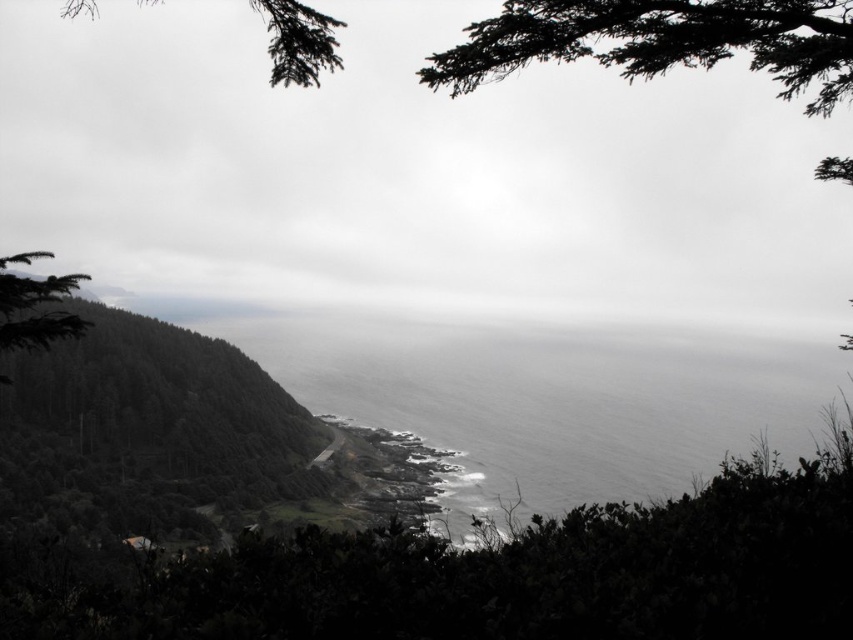
You are a photographer positioned at the center of the scene. You want to capture a shot of the gray matte water at center. Based on the scene description, where should you aim your camera relative to your current position?

The gray matte water at center is located at the point coordinates of 0.625 on the x axis and 0.648 on the y axis. Since you are at the center of the scene, you should aim your camera slightly to the right and upwards to capture the gray matte water at center.

You are a drone operator tasked with capturing aerial footage of the coastal landscape. You need to ensure that both the gray matte water at center and the green matte tree at upper left are in frame. Given that your drone camera has a maximum field of view of 80 meters, will you be able to capture both objects in a single shot?

The gray matte water at center and green matte tree at upper left are 84.78 meters apart. Since the distance between them exceeds the camera field of view of 80 meters, you will not be able to capture both objects in a single shot.